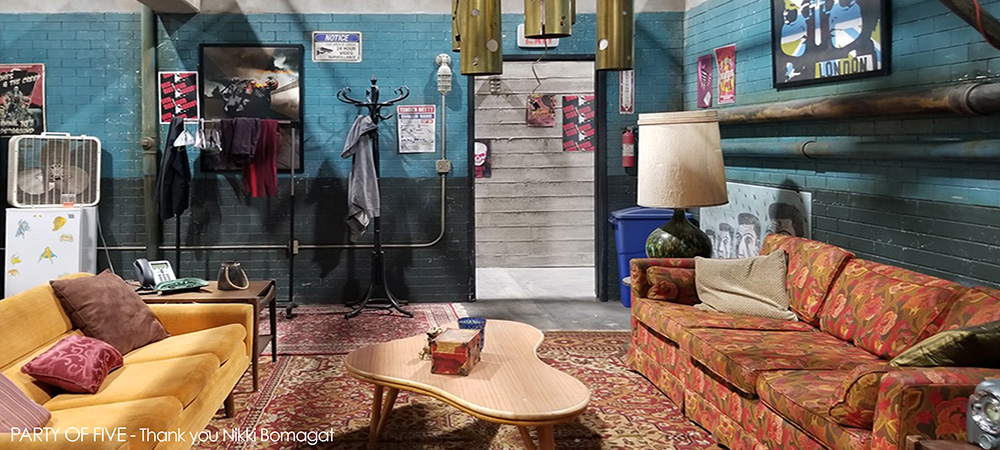
Locate an element on the screen. This screenshot has width=1000, height=450. gray floor is located at coordinates point(593,316).